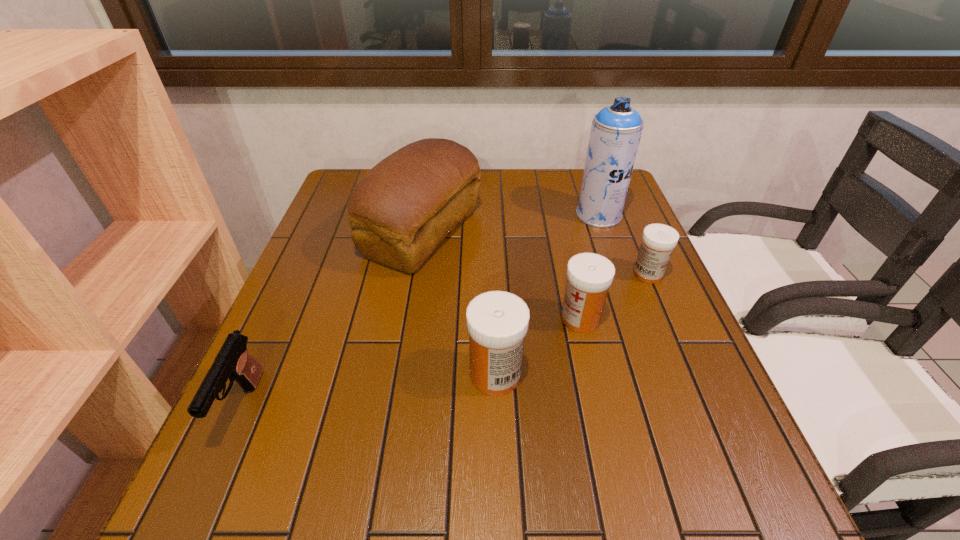
Given the evenly spaced medicines in the image, where should an extra medicine be added on the left to preserve the spacing? Please point to a vacant space. Please provide its 2D coordinates. Your answer should be formatted as a tuple, i.e. [(x, y)], where the tuple contains the x and y coordinates of a point satisfying the conditions above.

[(386, 446)]